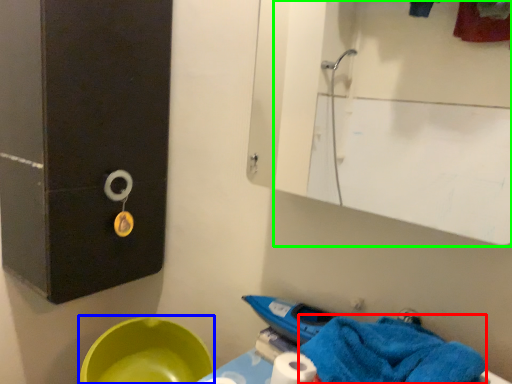
Question: Which object is the closest to the bath towel (highlighted by a red box)? Choose among these: basin (highlighted by a blue box) or mirror (highlighted by a green box).

Choices:
 (A) basin
 (B) mirror

Answer: (A)